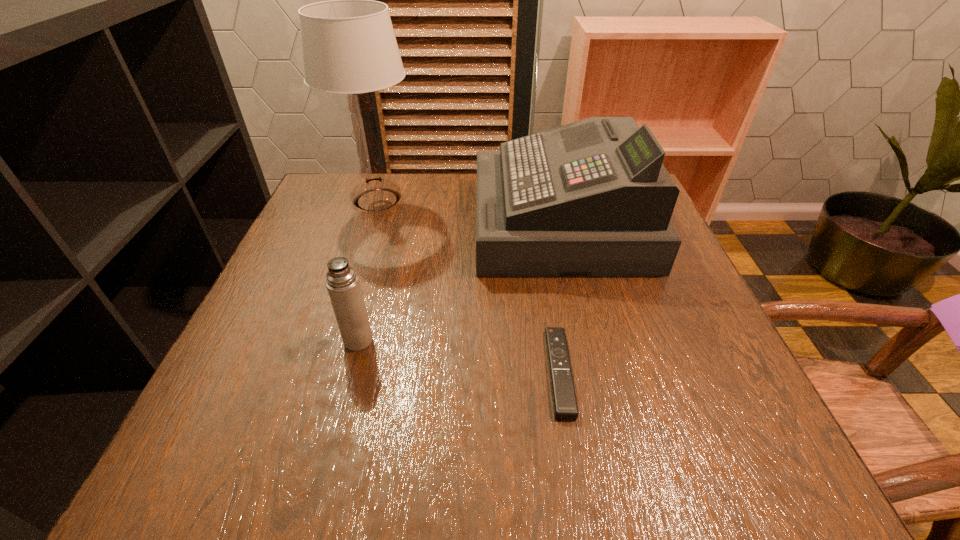
At what (x,y) coordinates should I click in order to perform the action: click on table lamp. Please return your answer as a coordinate pair (x, y). Looking at the image, I should click on 349,46.

Locate an element on the screen. Image resolution: width=960 pixels, height=540 pixels. the third shortest object is located at coordinates (590, 198).

Locate an element on the screen. The image size is (960, 540). the third tallest object is located at coordinates (343, 285).

Find the location of a particular element. This screenshot has width=960, height=540. the shortest object is located at coordinates (565, 406).

This screenshot has height=540, width=960. In order to click on vacant point located on the front-facing side of the table lamp in this screenshot , I will do `click(364, 242)`.

At what (x,y) coordinates should I click in order to perform the action: click on vacant point located 0.290m on the front-facing side of the cash register. Please return your answer as a coordinate pair (x, y). The height and width of the screenshot is (540, 960). Looking at the image, I should click on (356, 223).

The image size is (960, 540). I want to click on vacant space situated on the front-facing side of the cash register, so pyautogui.click(x=419, y=223).

Where is `vacant position located 0.170m on the front-facing side of the cash register`? Image resolution: width=960 pixels, height=540 pixels. vacant position located 0.170m on the front-facing side of the cash register is located at coordinates (406, 223).

Locate an element on the screen. vacant space situated 0.270m on the back of the thermos bottle is located at coordinates (385, 240).

Find the location of a particular element. The height and width of the screenshot is (540, 960). vacant space situated on the left of the remote control is located at coordinates (513, 372).